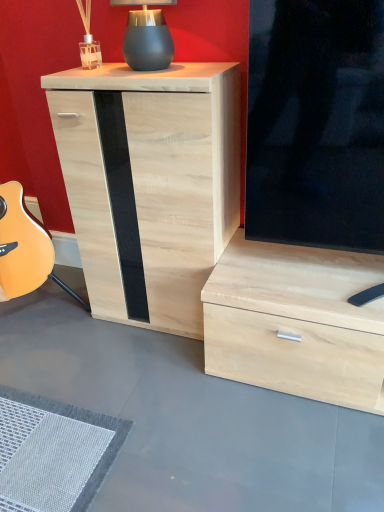
This screenshot has width=384, height=512. In order to click on vacant point to the right of matte black lamp at upper center in this screenshot , I will do `click(208, 62)`.